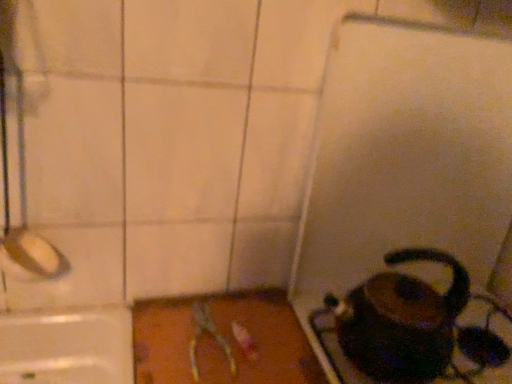
Question: Based on their sizes in the image, would you say metallic silver scissors at center is bigger or smaller than shiny black kettle at lower right?

Choices:
 (A) big
 (B) small

Answer: (B)

Question: Is metallic silver scissors at center inside or outside of shiny black kettle at lower right?

Choices:
 (A) inside
 (B) outside

Answer: (B)

Question: Is point (218, 331) positioned closer to the camera than point (402, 274)?

Choices:
 (A) closer
 (B) farther

Answer: (A)

Question: Does point (362, 329) appear closer or farther from the camera than point (221, 337)?

Choices:
 (A) farther
 (B) closer

Answer: (B)

Question: In the image, is shiny black kettle at lower right on the left side or the right side of metallic silver scissors at center?

Choices:
 (A) right
 (B) left

Answer: (A)

Question: Considering their positions, is shiny black kettle at lower right located in front of or behind metallic silver scissors at center?

Choices:
 (A) front
 (B) behind

Answer: (A)

Question: Looking at their shapes, would you say shiny black kettle at lower right is wider or thinner than metallic silver scissors at center?

Choices:
 (A) wide
 (B) thin

Answer: (B)